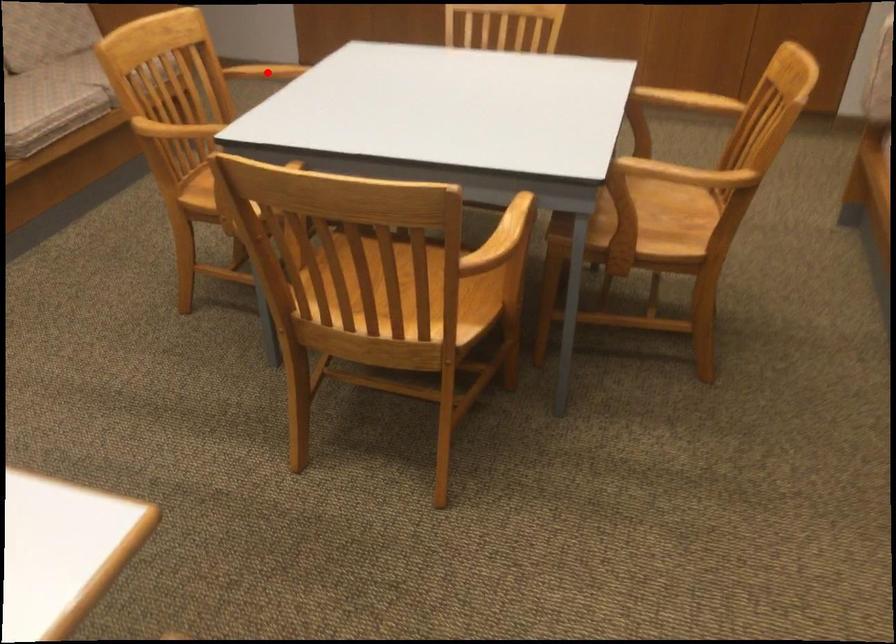
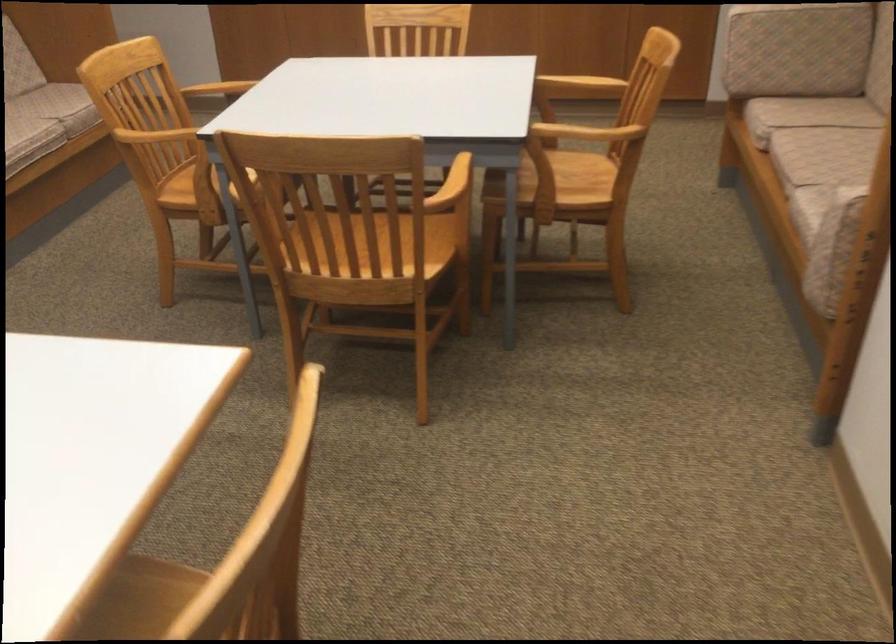
Question: A red point is marked in image1. In image2, is the corresponding 3D point closer to the camera or farther? Reply with the corresponding letter.

Choices:
 (A) The corresponding 3D point is closer.
 (B) The corresponding 3D point is farther.

Answer: (B)